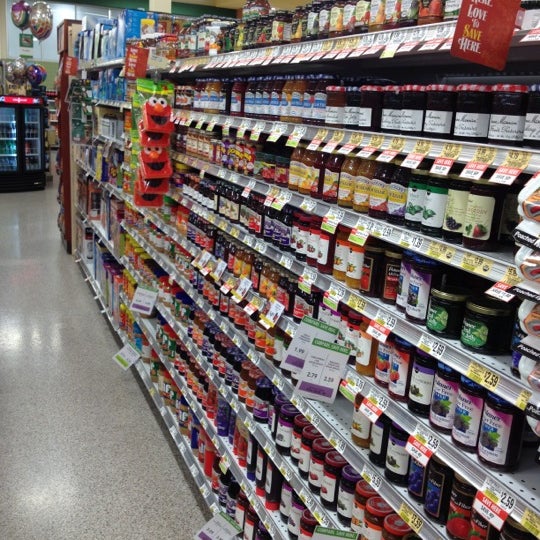
Identify the location of boxes. (126, 30).